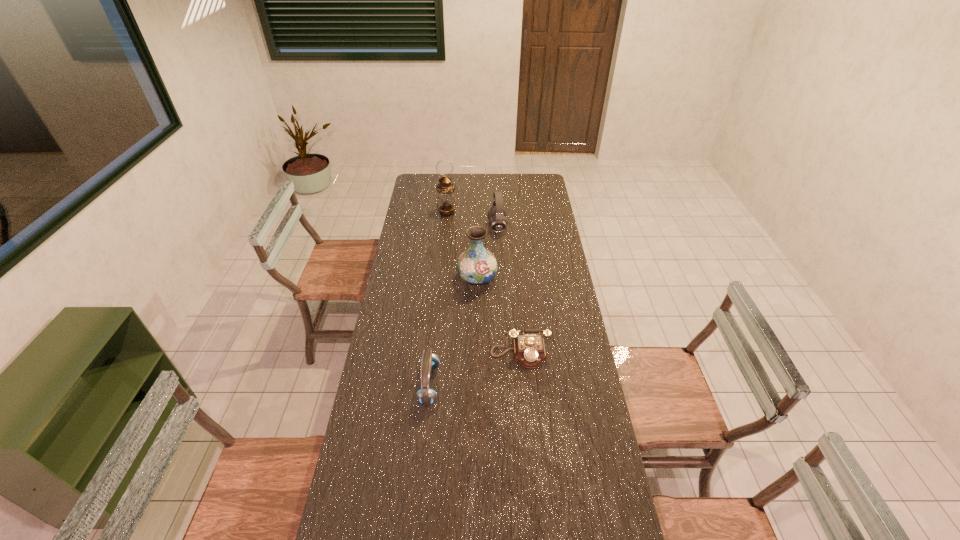
Locate an element on the screen. empty space between the right headset and the oil lamp is located at coordinates (472, 220).

At what (x,y) coordinates should I click in order to perform the action: click on vacant area that lies between the second tallest object and the left headset. Please return your answer as a coordinate pair (x, y). Looking at the image, I should click on (453, 331).

You are a GUI agent. You are given a task and a screenshot of the screen. Output one action in this format:
    pyautogui.click(x=<x>, y=<y>)
    Task: Click on the blank region between the third nearest object and the telephone
    This screenshot has height=540, width=960.
    Given the screenshot: What is the action you would take?
    pyautogui.click(x=498, y=315)

Identify which object is located as the nearest to the third nearest object. Please provide its 2D coordinates. Your answer should be formatted as a tuple, i.e. [(x, y)], where the tuple contains the x and y coordinates of a point satisfying the conditions above.

[(498, 222)]

Choose which object is the second nearest neighbor to the nearer headset. Please provide its 2D coordinates. Your answer should be formatted as a tuple, i.e. [(x, y)], where the tuple contains the x and y coordinates of a point satisfying the conditions above.

[(477, 265)]

Identify the location of blank area in the image that satisfies the following two spatial constraints: 1. on the front side of the vase; 2. on the ear cups of the left headset. This screenshot has width=960, height=540. (476, 384).